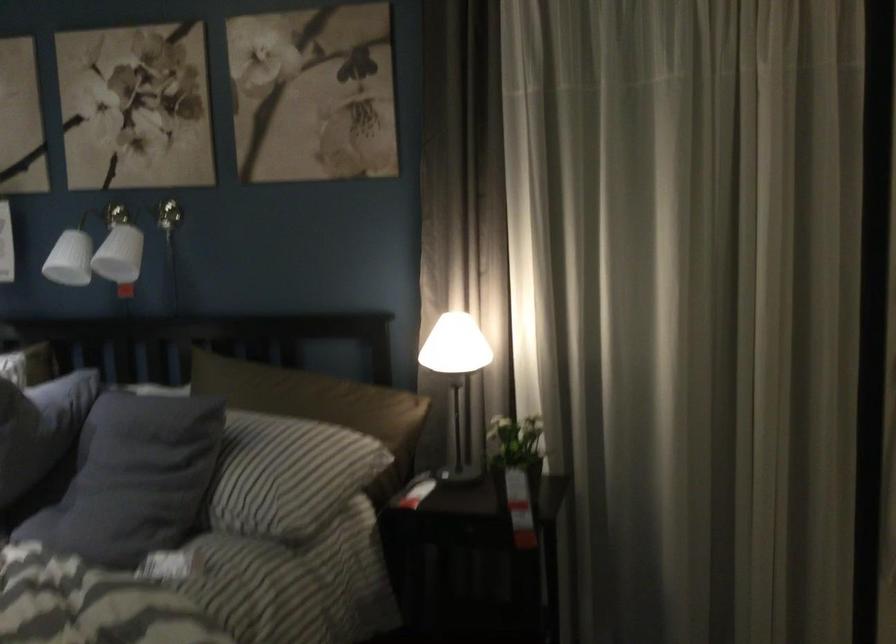
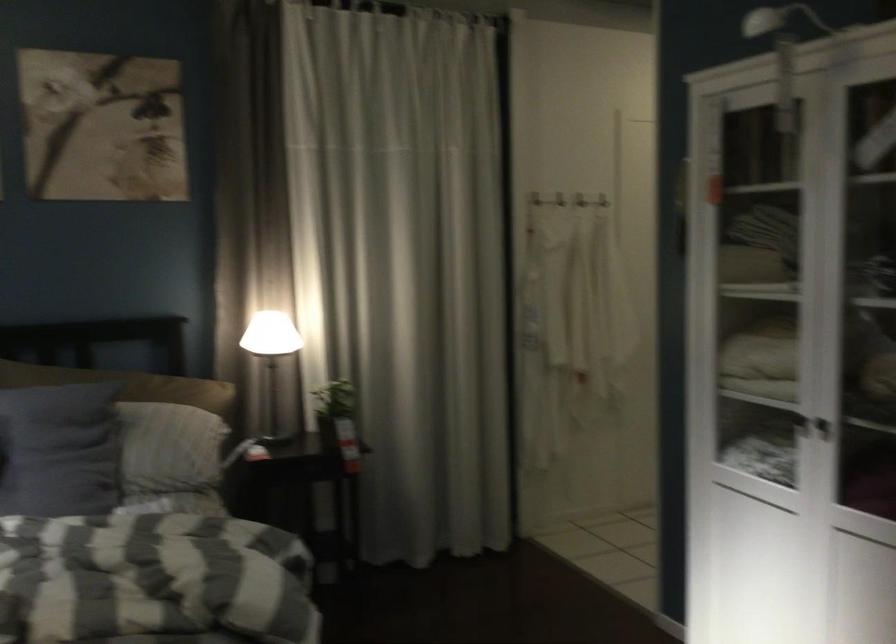
Locate, in the second image, the point that corresponds to (140,469) in the first image.

(58, 450)